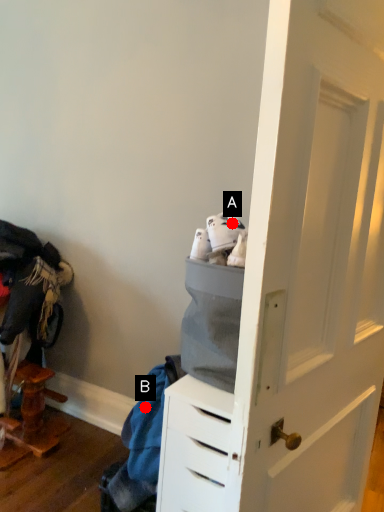
Question: Two points are circled on the image, labeled by A and B beside each circle. Which point is closer to the camera taking this photo?

Choices:
 (A) A is closer
 (B) B is closer

Answer: (A)